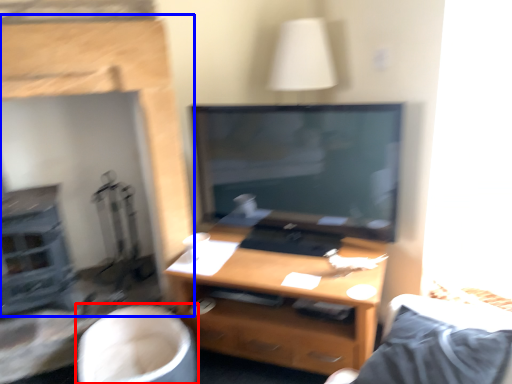
Question: Which point is further to the camera, swivel chair (highlighted by a red box) or fireplace (highlighted by a blue box)?

Choices:
 (A) swivel chair
 (B) fireplace

Answer: (A)